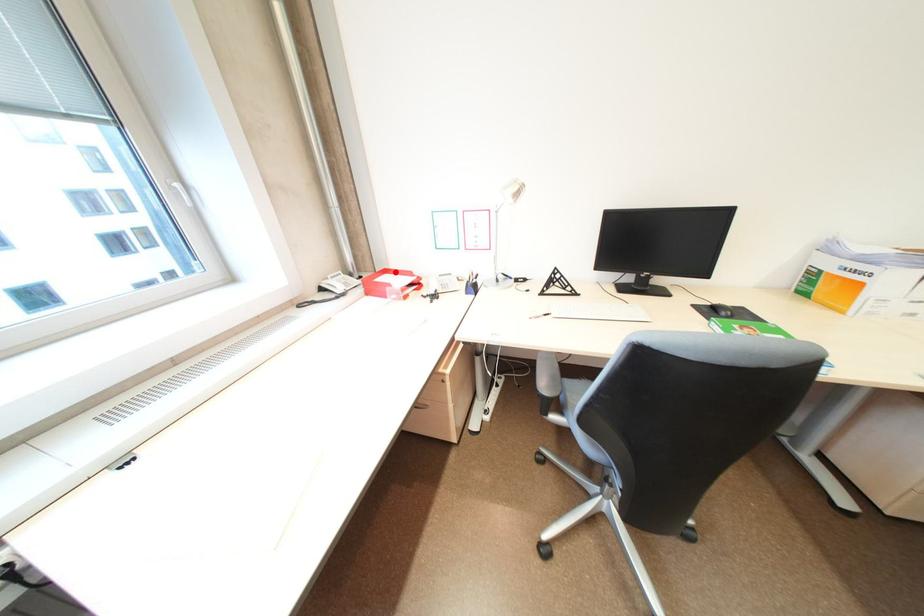
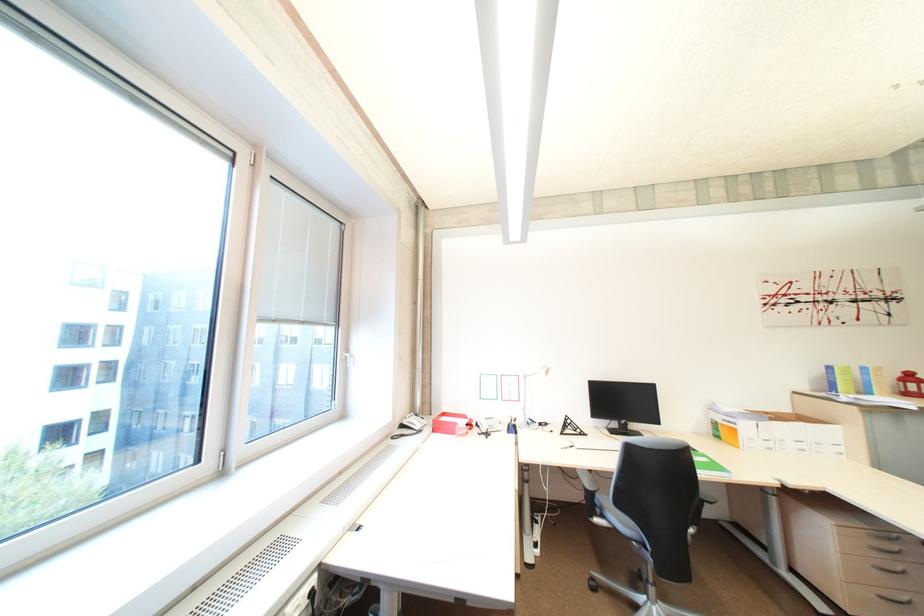
Question: I am providing you with two images of the same scene from different viewpoints. A red point is shown in image1. For the corresponding object point in image2, is it positioned nearer or farther from the camera?

Choices:
 (A) Nearer
 (B) Farther

Answer: (B)